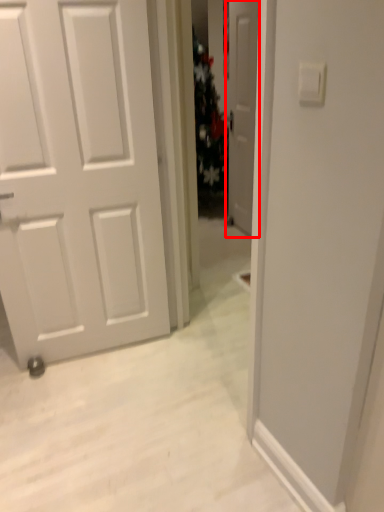
Question: From the image's perspective, where is door (annotated by the red box) located relative to light switch?

Choices:
 (A) above
 (B) below

Answer: (A)